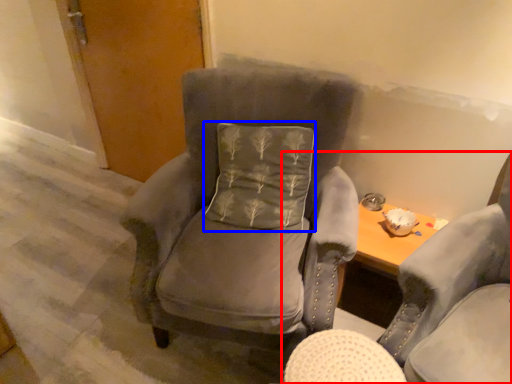
Question: Which object is further to the camera taking this photo, chair (highlighted by a red box) or pillow (highlighted by a blue box)?

Choices:
 (A) chair
 (B) pillow

Answer: (B)